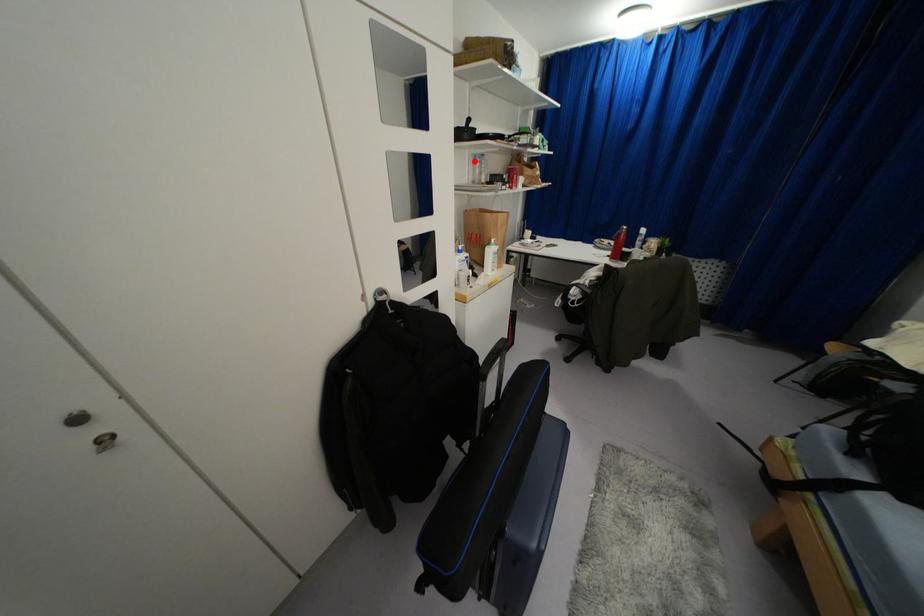
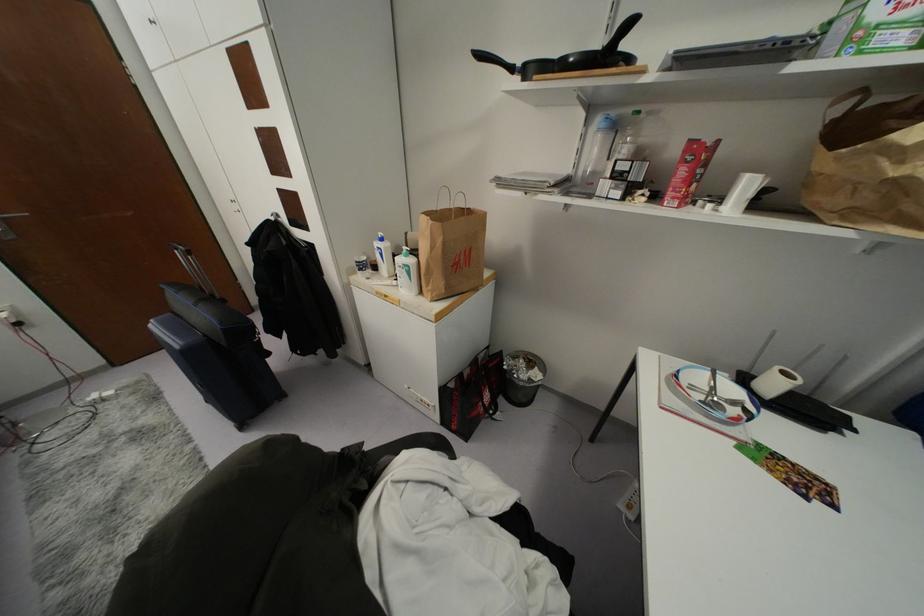
In the second image, find the point that corresponds to the highlighted location in the first image.

(599, 130)